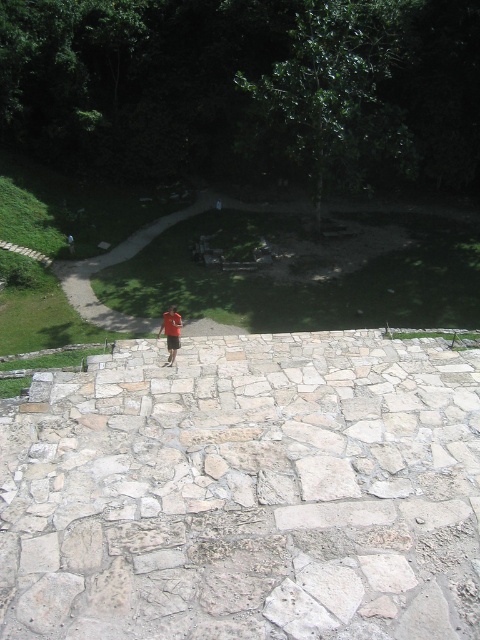
You are standing at the center of the stone walkway in the ancient site. You see a point labeled as point (117, 262). What is the object located at that point?

The point (117, 262) corresponds to green grass at lower left.